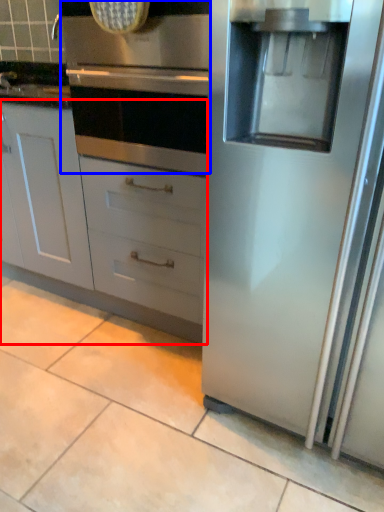
Question: Among these objects, which one is nearest to the camera, cabinetry (highlighted by a red box) or oven (highlighted by a blue box)?

Choices:
 (A) cabinetry
 (B) oven

Answer: (B)